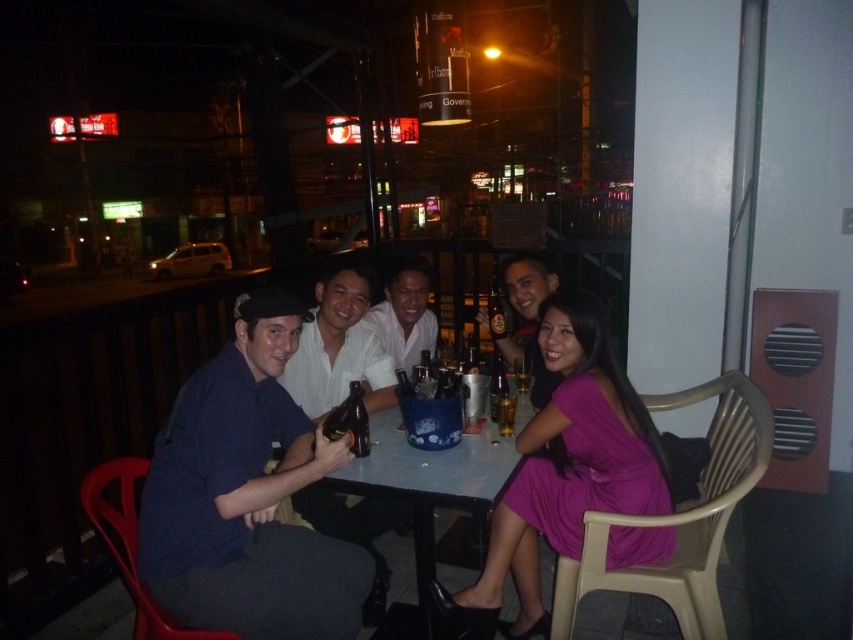
Looking at this image, you are a photographer trying to capture a closeup of the brown glass bottle at table center without including the white matte shirt at center in the frame. Is this possible given their positions?

The white matte shirt at center is above the brown glass bottle at table center, so if you position the camera below the shirt and aim upwards, you can capture the bottle without the shirt in the frame.

You are standing at the origin point of the image coordinate system. The image coordinate system has its origin at the bottom left corner of the image. The X axis points to the right and the Y axis points upward. You want to take a photo of the white matte shirt at center. In which direction should you move your camera to get the best shot?

The white matte shirt at center is located at coordinate point [405,314]. Since the origin is at the bottom left corner, moving the camera slightly to the right and upward would align it with the shirt.